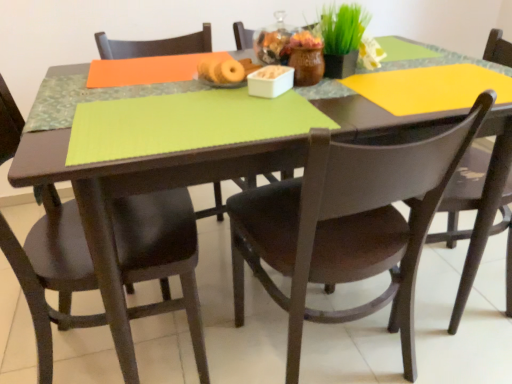
Question: From a real-world perspective, does matte black chair at left, which is the 3th chair in right-to-left order, stand above matte black chair at center, which is the 2th chair from left to right?

Choices:
 (A) no
 (B) yes

Answer: (A)

Question: Is matte black chair at left, the 1th chair in the left-to-right sequence, at the left side of matte black chair at center, positioned as the 2th chair in right-to-left order?

Choices:
 (A) no
 (B) yes

Answer: (B)

Question: Are matte black chair at left, the 1th chair in the left-to-right sequence, and matte black chair at center, which is the 2th chair from left to right, making contact?

Choices:
 (A) yes
 (B) no

Answer: (B)

Question: Is matte black chair at left, which is the 3th chair in right-to-left order, facing away from matte black chair at center, which is the 2th chair from left to right?

Choices:
 (A) yes
 (B) no

Answer: (B)

Question: Is matte black chair at left, the 1th chair in the left-to-right sequence, bigger than matte black chair at center, which is the 2th chair from left to right?

Choices:
 (A) yes
 (B) no

Answer: (B)

Question: From a real-world perspective, is matte black chair at left, which is the 3th chair in right-to-left order, beneath matte black chair at center, positioned as the 2th chair in right-to-left order?

Choices:
 (A) yes
 (B) no

Answer: (A)

Question: Is matte black chair at right, the first chair from the right, facing towards matte black chair at center, positioned as the 2th chair in right-to-left order?

Choices:
 (A) yes
 (B) no

Answer: (A)

Question: Is matte black chair at right, positioned as the 3th chair in left-to-right order, in front of matte black chair at center, positioned as the 2th chair in right-to-left order?

Choices:
 (A) yes
 (B) no

Answer: (B)

Question: From a real-world perspective, is matte black chair at right, the first chair from the right, under matte black chair at center, positioned as the 2th chair in right-to-left order?

Choices:
 (A) yes
 (B) no

Answer: (A)

Question: From a real-world perspective, does matte black chair at right, the first chair from the right, stand above matte black chair at center, positioned as the 2th chair in right-to-left order?

Choices:
 (A) yes
 (B) no

Answer: (B)

Question: Can we say matte black chair at right, positioned as the 3th chair in left-to-right order, lies outside matte black chair at center, which is the 2th chair from left to right?

Choices:
 (A) no
 (B) yes

Answer: (B)

Question: Does matte black chair at right, the first chair from the right, have a larger size compared to matte black chair at center, positioned as the 2th chair in right-to-left order?

Choices:
 (A) no
 (B) yes

Answer: (B)

Question: Is there a large distance between green matte plant at upper center and matte black chair at right, the first chair from the right?

Choices:
 (A) no
 (B) yes

Answer: (A)